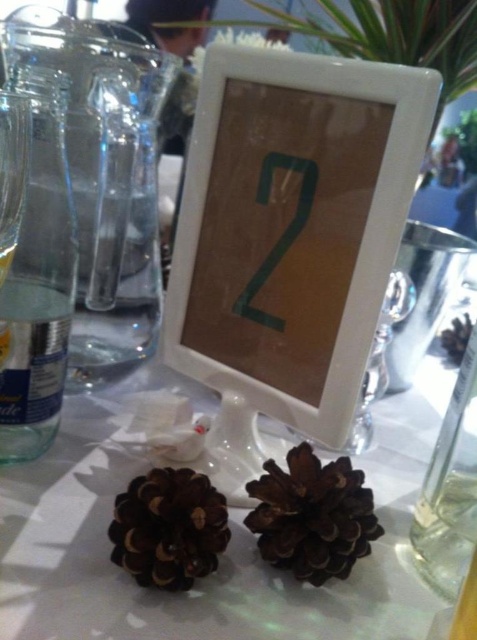
Between point (33, 116) and point (190, 573), which one is positioned behind?

Point (33, 116)

Where is `clear glass bottle at left`? clear glass bottle at left is located at coordinates (39, 280).

Locate an element on the screen. clear glass bottle at left is located at coordinates (39, 280).

Does clear glass bottle at left appear on the left side of green cardboard number at center?

Indeed, clear glass bottle at left is positioned on the left side of green cardboard number at center.

Is point (62, 321) less distant than point (268, 173)?

No, (62, 321) is behind (268, 173).

Where is `clear glass bottle at left`? This screenshot has height=640, width=477. clear glass bottle at left is located at coordinates (39, 280).

Where is `clear glass bottle at left`? clear glass bottle at left is located at coordinates (39, 280).

Which of these two, brown textured pine cone at center or brown matte pine cone at lower left, stands taller?

brown textured pine cone at center

Between point (342, 467) and point (204, 490), which one is positioned behind?

The point (342, 467) is behind.

This screenshot has width=477, height=640. Identify the location of brown textured pine cone at center. (311, 515).